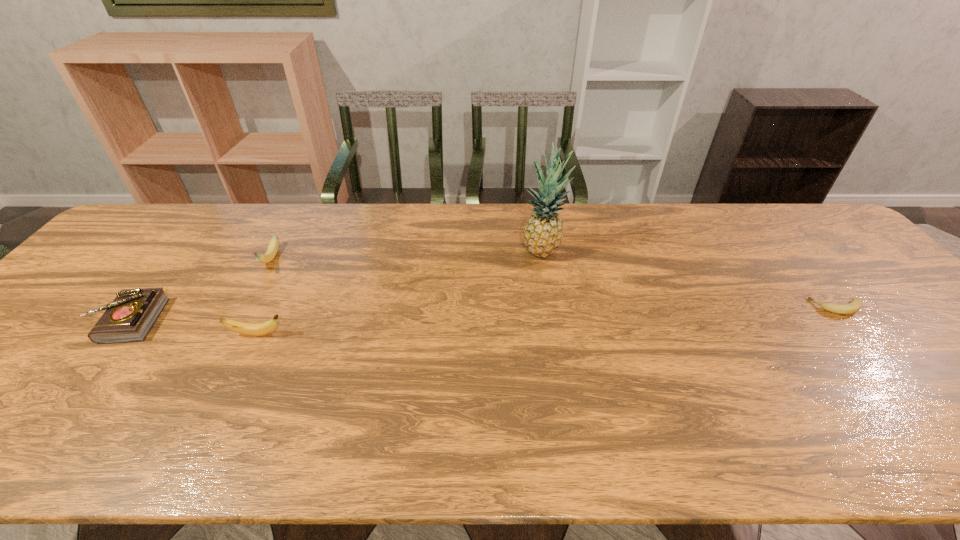
Find the location of a particular element. the tallest object is located at coordinates (543, 233).

Find the location of a particular element. pineapple is located at coordinates (543, 233).

Locate an element on the screen. The width and height of the screenshot is (960, 540). the farthest banana is located at coordinates (272, 250).

Locate an element on the screen. The width and height of the screenshot is (960, 540). the nearest banana is located at coordinates (259, 329).

At what (x,y) coordinates should I click in order to perform the action: click on the leftmost object. Please return your answer as a coordinate pair (x, y). Looking at the image, I should click on (129, 318).

The height and width of the screenshot is (540, 960). In order to click on diary in this screenshot , I will do `click(129, 318)`.

Where is `the rightmost banana`? This screenshot has width=960, height=540. the rightmost banana is located at coordinates (855, 305).

You are a GUI agent. You are given a task and a screenshot of the screen. Output one action in this format:
    pyautogui.click(x=<x>, y=<y>)
    Task: Click on the shortest object
    Image resolution: width=960 pixels, height=540 pixels.
    Given the screenshot: What is the action you would take?
    pyautogui.click(x=855, y=305)

Identify the location of vacant space situated on the back of the tallest object. (x=536, y=208).

Locate an element on the screen. This screenshot has width=960, height=540. vacant space located at the stem of the farthest banana is located at coordinates (204, 382).